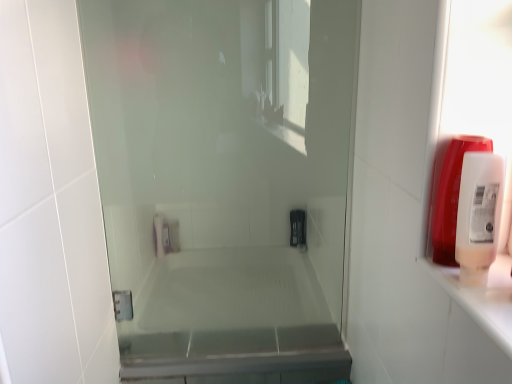
Question: From the image's perspective, is white plastic soap dispenser at right, placed as the 1th soap dispenser when sorted from front to back, positioned above or below translucent plastic soap dispenser at right, the 1th soap dispenser in the back-to-front sequence?

Choices:
 (A) above
 (B) below

Answer: (B)

Question: Is point tap(459, 201) closer or farther from the camera than point tap(436, 175)?

Choices:
 (A) farther
 (B) closer

Answer: (B)

Question: Which of these objects is positioned closest to the white plastic soap dispenser at right, the 2th soap dispenser when ordered from back to front?

Choices:
 (A) transparent glass shower door at center
 (B) translucent plastic soap dispenser at right, the 1th soap dispenser in the back-to-front sequence

Answer: (B)

Question: Which object is positioned farthest from the translucent plastic soap dispenser at right, which is the 2th soap dispenser in front-to-back order?

Choices:
 (A) transparent glass shower door at center
 (B) white plastic soap dispenser at right, the 2th soap dispenser when ordered from back to front

Answer: (A)